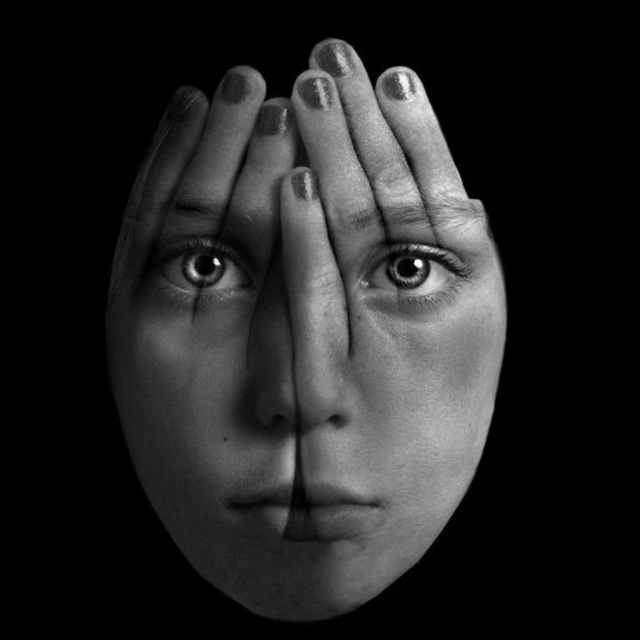
Based on the scene description, which object has a greater width when comparing the smooth skin forehead at center and the shiny gray eye at center?

The smooth skin forehead at center has a greater width than the shiny gray eye at center.

From the picture: Looking at the black and white photo, you notice the smooth skin face at center and the smooth skin forehead at center. Which of these two is positioned lower on the subject?

The smooth skin face at center is located below the smooth skin forehead at center, so the smooth skin face at center is positioned lower.